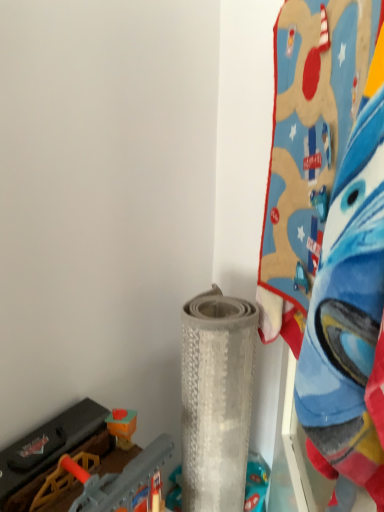
Question: Considering the relative sizes of gray textured mat at center, the second toy viewed from the left, and plastic toy train at lower left, placed as the first toy when sorted from left to right, in the image provided, is gray textured mat at center, the second toy viewed from the left, thinner than plastic toy train at lower left, placed as the first toy when sorted from left to right,?

Choices:
 (A) yes
 (B) no

Answer: (A)

Question: Are gray textured mat at center, the second toy viewed from the left, and plastic toy train at lower left, placed as the first toy when sorted from left to right, far apart?

Choices:
 (A) no
 (B) yes

Answer: (A)

Question: Can plastic toy train at lower left, positioned as the third toy in right-to-left order, be found inside gray textured mat at center, acting as the second toy starting from the right?

Choices:
 (A) yes
 (B) no

Answer: (B)

Question: Is the depth of gray textured mat at center, acting as the second toy starting from the right, greater than that of plastic toy train at lower left, placed as the first toy when sorted from left to right?

Choices:
 (A) yes
 (B) no

Answer: (A)

Question: Is gray textured mat at center, the second toy viewed from the left, turned away from plastic toy train at lower left, placed as the first toy when sorted from left to right?

Choices:
 (A) no
 (B) yes

Answer: (A)

Question: Is gray textured mat at center, the second toy viewed from the left, at the left side of plastic toy train at lower left, placed as the first toy when sorted from left to right?

Choices:
 (A) no
 (B) yes

Answer: (A)

Question: Does blue plush blanket at upper right, the 3th toy positioned from the left, have a greater width compared to plastic toy train at lower left, placed as the first toy when sorted from left to right?

Choices:
 (A) no
 (B) yes

Answer: (A)

Question: Can you confirm if blue plush blanket at upper right, the 3th toy positioned from the left, is shorter than plastic toy train at lower left, placed as the first toy when sorted from left to right?

Choices:
 (A) yes
 (B) no

Answer: (B)

Question: Could you tell me if blue plush blanket at upper right, the 3th toy positioned from the left, is turned towards plastic toy train at lower left, positioned as the third toy in right-to-left order?

Choices:
 (A) yes
 (B) no

Answer: (B)

Question: Is the depth of blue plush blanket at upper right, the 3th toy positioned from the left, greater than that of plastic toy train at lower left, placed as the first toy when sorted from left to right?

Choices:
 (A) no
 (B) yes

Answer: (A)

Question: Considering the relative sizes of blue plush blanket at upper right, which is the 1th toy from right to left, and plastic toy train at lower left, placed as the first toy when sorted from left to right, in the image provided, is blue plush blanket at upper right, which is the 1th toy from right to left, taller than plastic toy train at lower left, placed as the first toy when sorted from left to right,?

Choices:
 (A) no
 (B) yes

Answer: (B)

Question: From the image's perspective, would you say blue plush blanket at upper right, the 3th toy positioned from the left, is positioned over plastic toy train at lower left, positioned as the third toy in right-to-left order?

Choices:
 (A) no
 (B) yes

Answer: (B)

Question: Can you confirm if gray textured mat at center, the second toy viewed from the left, is positioned to the left of blue plush blanket at upper right, the 3th toy positioned from the left?

Choices:
 (A) no
 (B) yes

Answer: (B)